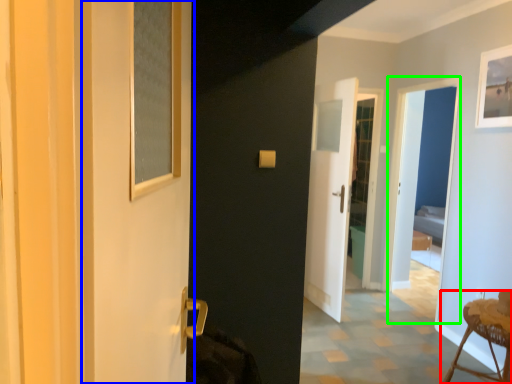
Question: Considering the real-world distances, which object is closest to furniture (highlighted by a red box)? screen door (highlighted by a blue box) or screen door (highlighted by a green box).

Choices:
 (A) screen door
 (B) screen door

Answer: (B)